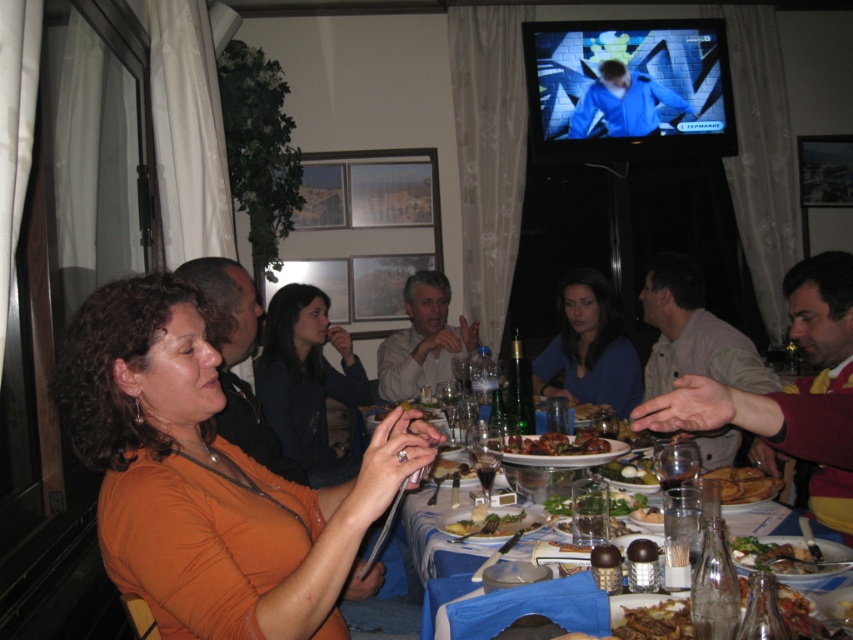
In the scene shown: Which is above, orange fabric shirt at lower left or wooden table at center?

wooden table at center is higher up.

Is orange fabric shirt at lower left above wooden table at center?

No, orange fabric shirt at lower left is not above wooden table at center.

Does point (204, 630) come closer to viewer compared to point (840, 458)?

Yes, it is in front of point (840, 458).

Find the location of a particular element. The width and height of the screenshot is (853, 640). orange fabric shirt at lower left is located at coordinates (207, 474).

Does smooth brown bread at center lie in front of green leafy vegetable at center?

Yes, it is.

Is smooth brown bread at center behind green leafy vegetable at center?

No.

Locate an element on the screen. This screenshot has height=640, width=853. smooth brown bread at center is located at coordinates (450, 468).

Can you confirm if wooden table at center is bigger than green leafy salad at center?

Correct, wooden table at center is larger in size than green leafy salad at center.

Identify the location of wooden table at center. The height and width of the screenshot is (640, 853). (758, 417).

Where is `wooden table at center`? The image size is (853, 640). wooden table at center is located at coordinates (758, 417).